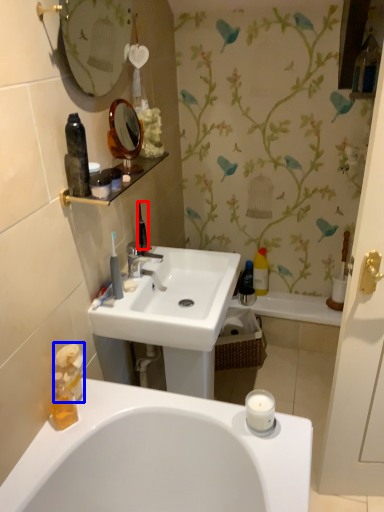
Question: Among these objects, which one is nearest to the camera, toiletries (highlighted by a red box) or toiletry (highlighted by a blue box)?

Choices:
 (A) toiletries
 (B) toiletry

Answer: (B)